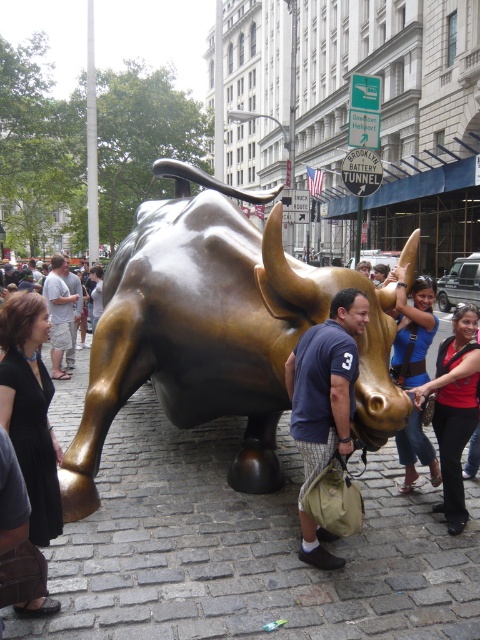
You are standing at the point marked as point (395, 368) in the image. You want to take a photo of the golden bull statue without any obstructions. The camera you are using has a focal length of 50mm. What is the minimum distance you should move forward to ensure the bull statue fills the frame completely?

The point (395, 368) is 4.33 meters away from the camera. To fill the frame with the golden bull statue, you need to move closer until the distance between you and the statue is less than 4.33 meters, ensuring no obstructions. However, precise calculation requires knowing the statue height and sensor size, which aren

From the picture: You are a photographer standing in the bustling urban scene with the golden bull statue. You notice a person wearing a blue fabric shirt at center and the matte gold statue at center. Which object is wider from your perspective?

The blue fabric shirt at center is wider than the matte gold statue at center according to the description.

In the scene shown: You are standing in the urban scene with the golden bull statue. You want to take a photo of the point at coordinate (364, 317). Is this point within your camera frame if your camera has a 10 feet focal length?

The point at coordinate (364, 317) is 10.78 feet away from the camera. Since the camera has a 10 feet focal length, the point is slightly beyond the focal range, so it may not be in clear focus or within the frame. Adjust your position or zoom to ensure it is captured properly.